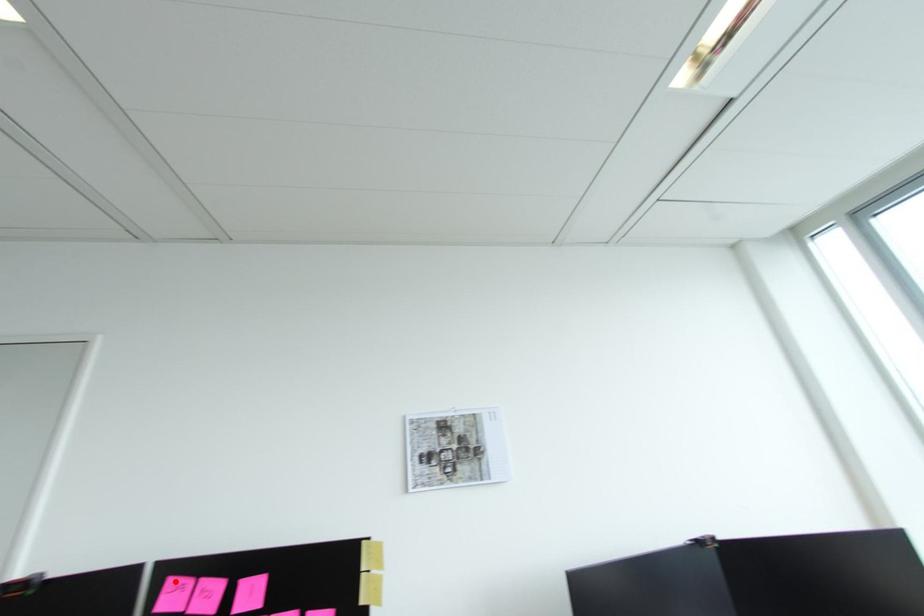
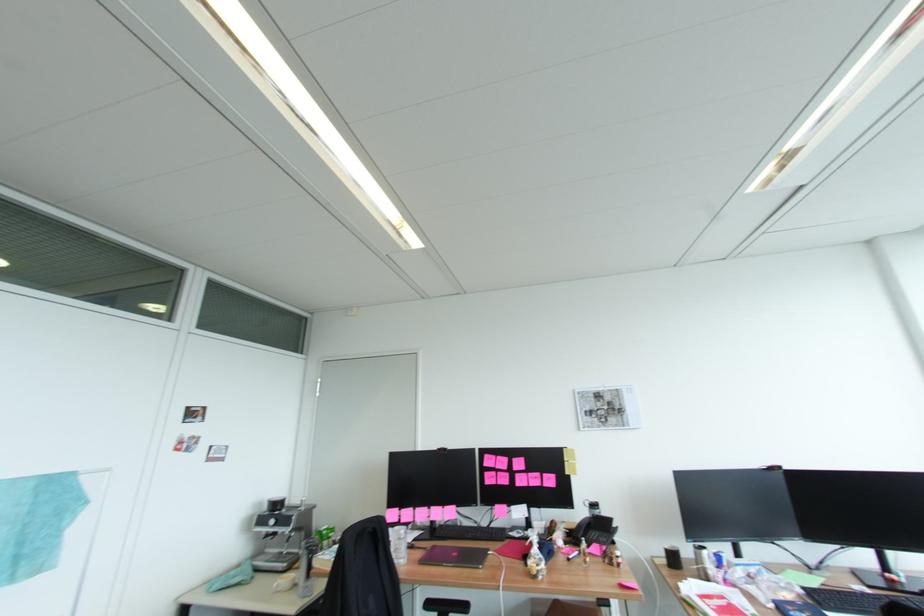
Question: I am providing you with two images of the same scene from different viewpoints. A red point is shown in image1. For the corresponding object point in image2, is it positioned nearer or farther from the camera?

Choices:
 (A) Nearer
 (B) Farther

Answer: (B)